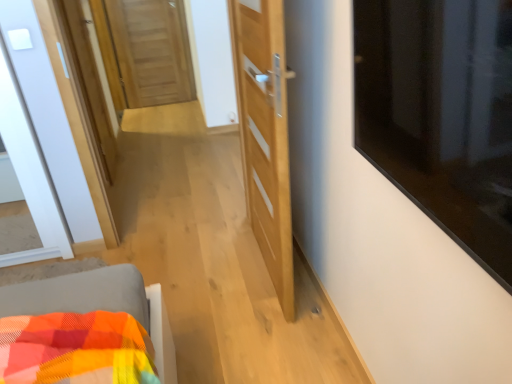
Question: Is transparent glass window at upper right oriented towards wooden door at center, which is counted as the 1th door, starting from the top?

Choices:
 (A) no
 (B) yes

Answer: (A)

Question: Is transparent glass window at upper right outside of wooden door at center, marked as the first door in a back-to-front arrangement?

Choices:
 (A) yes
 (B) no

Answer: (A)

Question: Is wooden door at center, which is counted as the 1th door, starting from the top, located within transparent glass window at upper right?

Choices:
 (A) no
 (B) yes

Answer: (A)

Question: Can you confirm if transparent glass window at upper right is wider than wooden door at center, marked as the first door in a back-to-front arrangement?

Choices:
 (A) no
 (B) yes

Answer: (B)

Question: From a real-world perspective, is transparent glass window at upper right physically below wooden door at center, the 1th door in the left-to-right sequence?

Choices:
 (A) no
 (B) yes

Answer: (A)

Question: From the image's perspective, is light wood door at center, arranged as the first door when ordered from the bottom, above or below wooden door at center, the second door positioned from the right?

Choices:
 (A) above
 (B) below

Answer: (B)

Question: Considering the positions of light wood door at center, the 1th door viewed from the front, and wooden door at center, which is counted as the 1th door, starting from the top, in the image, is light wood door at center, the 1th door viewed from the front, bigger or smaller than wooden door at center, which is counted as the 1th door, starting from the top,?

Choices:
 (A) big
 (B) small

Answer: (B)

Question: Visually, is light wood door at center, which appears as the 2th door when viewed from the back, positioned to the left or to the right of wooden door at center, positioned as the 2th door in bottom-to-top order?

Choices:
 (A) left
 (B) right

Answer: (B)

Question: Is light wood door at center, the 1th door viewed from the front, in front of or behind wooden door at center, which is counted as the 1th door, starting from the top, in the image?

Choices:
 (A) front
 (B) behind

Answer: (A)

Question: In the image, is wooden door at center, marked as the first door in a back-to-front arrangement, positioned in front of or behind transparent glass window at upper right?

Choices:
 (A) behind
 (B) front

Answer: (A)

Question: From the image's perspective, is wooden door at center, which appears as the second door when viewed from the front, located above or below transparent glass window at upper right?

Choices:
 (A) above
 (B) below

Answer: (A)

Question: In terms of width, does wooden door at center, the 1th door in the left-to-right sequence, look wider or thinner when compared to transparent glass window at upper right?

Choices:
 (A) thin
 (B) wide

Answer: (A)

Question: From a real-world perspective, is wooden door at center, which is counted as the 1th door, starting from the top, positioned above or below transparent glass window at upper right?

Choices:
 (A) above
 (B) below

Answer: (B)

Question: From a real-world perspective, is transparent glass window at upper right above or below light wood door at center, which is the first door from right to left?

Choices:
 (A) above
 (B) below

Answer: (A)

Question: Is transparent glass window at upper right inside or outside of light wood door at center, arranged as the first door when ordered from the bottom?

Choices:
 (A) outside
 (B) inside

Answer: (A)